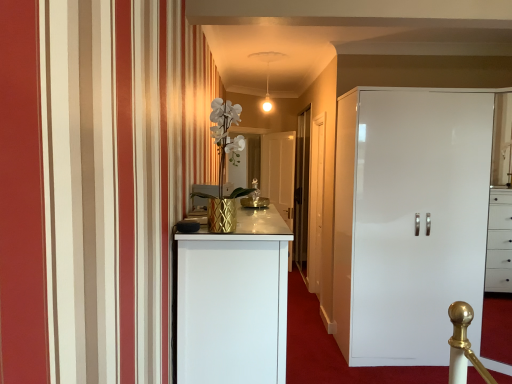
Image resolution: width=512 pixels, height=384 pixels. I want to click on white glossy door at center, the first door viewed from the back, so click(x=279, y=172).

The width and height of the screenshot is (512, 384). Describe the element at coordinates (224, 166) in the screenshot. I see `white textured vase at center` at that location.

The image size is (512, 384). Describe the element at coordinates (301, 191) in the screenshot. I see `transparent glass door at center` at that location.

This screenshot has width=512, height=384. What do you see at coordinates (316, 203) in the screenshot?
I see `white wooden door at center, the 1th door positioned from the front` at bounding box center [316, 203].

Find the location of `white glossy cupboard at right`. white glossy cupboard at right is located at coordinates (409, 220).

Describe the element at coordinates (409, 220) in the screenshot. I see `white glossy cupboard at right` at that location.

Identify the location of white glossy door at center, placed as the second door when sorted from right to left. This screenshot has width=512, height=384. (279, 172).

Is white wooden door at center, which ranks as the second door in back-to-front order, turned away from white glossy door at center, the first door viewed from the back?

No, white glossy door at center, the first door viewed from the back, is not at the back of white wooden door at center, which ranks as the second door in back-to-front order.

From the image's perspective, is white wooden door at center, positioned as the first door in right-to-left order, below white glossy door at center, the 2th door when ordered from front to back?

Yes, from the image's perspective, white wooden door at center, positioned as the first door in right-to-left order, is beneath white glossy door at center, the 2th door when ordered from front to back.

Is point (319, 218) closer or farther from the camera than point (286, 180)?

Point (319, 218).

Find the location of a particular element. door below the white glossy door at center, the 2th door when ordered from front to back (from the image's perspective) is located at coordinates (316, 203).

Is transparent glass door at center facing away from white wooden door at center, the 1th door positioned from the front?

No, transparent glass door at center is not facing away from white wooden door at center, the 1th door positioned from the front.

From the image's perspective, is transparent glass door at center beneath white wooden door at center, which ranks as the second door in back-to-front order?

Incorrect, from the image's perspective, transparent glass door at center is higher than white wooden door at center, which ranks as the second door in back-to-front order.

Is transparent glass door at center not close to white wooden door at center, which ranks as the second door in back-to-front order?

No, transparent glass door at center is not far from white wooden door at center, which ranks as the second door in back-to-front order.

Is transparent glass door at center at the right side of white wooden door at center, the 1th door positioned from the front?

No.

Can you confirm if white glossy cupboard at right is taller than white textured vase at center?

Yes, white glossy cupboard at right is taller than white textured vase at center.

Find the location of a particular element. The image size is (512, 384). cupboard below the white textured vase at center (from a real-world perspective) is located at coordinates (409, 220).

Does white glossy cupboard at right lie in front of white textured vase at center?

That is False.

Considering the relative sizes of white glossy cupboard at right and white textured vase at center in the image provided, is white glossy cupboard at right wider than white textured vase at center?

Indeed, white glossy cupboard at right has a greater width compared to white textured vase at center.

Is transparent glass door at center beside white glossy door at center, placed as the second door when sorted from right to left?

No.

Is transparent glass door at center in front of or behind white glossy door at center, the first door viewed from the back, in the image?

transparent glass door at center is positioned closer to the viewer than white glossy door at center, the first door viewed from the back.

Which is nearer, (301, 245) or (283, 148)?

Point (301, 245) appears to be closer to the viewer than point (283, 148).

Is white wooden door at center, the 1th door positioned from the front, in front of or behind transparent glass door at center in the image?

Visually, white wooden door at center, the 1th door positioned from the front, is located in front of transparent glass door at center.

Looking at the image, does white wooden door at center, which is the second door in left-to-right order, seem bigger or smaller compared to transparent glass door at center?

Considering their sizes, white wooden door at center, which is the second door in left-to-right order, takes up less space than transparent glass door at center.

Considering the relative sizes of white wooden door at center, positioned as the first door in right-to-left order, and transparent glass door at center in the image provided, is white wooden door at center, positioned as the first door in right-to-left order, thinner than transparent glass door at center?

Incorrect, the width of white wooden door at center, positioned as the first door in right-to-left order, is not less than that of transparent glass door at center.

Which is more to the right, white wooden door at center, the 1th door positioned from the front, or transparent glass door at center?

white wooden door at center, the 1th door positioned from the front, is more to the right.

Would you say transparent glass door at center is a long distance from white glossy cupboard at right?

Yes, transparent glass door at center is far from white glossy cupboard at right.

Can we say transparent glass door at center lies outside white glossy cupboard at right?

Absolutely, transparent glass door at center is external to white glossy cupboard at right.

Which is more to the right, transparent glass door at center or white glossy cupboard at right?

From the viewer's perspective, white glossy cupboard at right appears more on the right side.

Is white glossy cupboard at right taller than white wooden door at center, positioned as the first door in right-to-left order?

Yes, white glossy cupboard at right is taller than white wooden door at center, positioned as the first door in right-to-left order.

Which of these two, white glossy cupboard at right or white wooden door at center, which ranks as the second door in back-to-front order, is thinner?

white wooden door at center, which ranks as the second door in back-to-front order, is thinner.

From a real-world perspective, is white glossy cupboard at right located beneath white wooden door at center, which is the second door in left-to-right order?

Yes.

The width and height of the screenshot is (512, 384). In order to click on door on the left of the white wooden door at center, the 1th door positioned from the front in this screenshot , I will do `click(279, 172)`.

I want to click on door located on the right of transparent glass door at center, so click(x=316, y=203).

Consider the image. Based on their spatial positions, is white glossy door at center, the first door viewed from the back, or white wooden door at center, which is the second door in left-to-right order, further from white glossy cupboard at right?

white glossy door at center, the first door viewed from the back.

Which object lies nearer to the anchor point white wooden door at center, which is the second door in left-to-right order, transparent glass door at center or white glossy cupboard at right?

transparent glass door at center lies closer to white wooden door at center, which is the second door in left-to-right order, than the other object.

From the image, which object appears to be nearer to transparent glass door at center, white glossy door at center, the first door in the left-to-right sequence, or white wooden door at center, which is the second door in left-to-right order?

Based on the image, white glossy door at center, the first door in the left-to-right sequence, appears to be nearer to transparent glass door at center.

Which object lies nearer to the anchor point white glossy cupboard at right, transparent glass door at center or white glossy door at center, the first door in the left-to-right sequence?

Among the two, transparent glass door at center is located nearer to white glossy cupboard at right.

Which object lies nearer to the anchor point white glossy cupboard at right, white glossy door at center, the first door viewed from the back, or transparent glass door at center?

Among the two, transparent glass door at center is located nearer to white glossy cupboard at right.

Which object lies further to the anchor point white textured vase at center, white wooden door at center, which is the second door in left-to-right order, or transparent glass door at center?

The object further to white textured vase at center is transparent glass door at center.

Consider the image. Looking at the image, which one is located closer to white glossy door at center, the first door viewed from the back, white textured vase at center or white wooden door at center, the 1th door positioned from the front?

white wooden door at center, the 1th door positioned from the front.

Considering their positions, is white glossy door at center, the 2th door when ordered from front to back, positioned further to transparent glass door at center than white glossy cupboard at right?

Based on the image, white glossy cupboard at right appears to be further to transparent glass door at center.

Where is `door between white textured vase at center and white glossy door at center, the first door in the left-to-right sequence, from front to back`? This screenshot has height=384, width=512. door between white textured vase at center and white glossy door at center, the first door in the left-to-right sequence, from front to back is located at coordinates (316, 203).

You are a GUI agent. You are given a task and a screenshot of the screen. Output one action in this format:
    pyautogui.click(x=<x>, y=<y>)
    Task: Click on the cupboard between white textured vase at center and white glossy door at center, the 2th door when ordered from front to back, from front to back
    The height and width of the screenshot is (384, 512).
    Given the screenshot: What is the action you would take?
    pyautogui.click(x=409, y=220)

You are a GUI agent. You are given a task and a screenshot of the screen. Output one action in this format:
    pyautogui.click(x=<x>, y=<y>)
    Task: Click on the glass door between white glossy cupboard at right and white glossy door at center, the 2th door when ordered from front to back, along the z-axis
    
    Given the screenshot: What is the action you would take?
    pyautogui.click(x=301, y=191)

Where is `door positioned between white glossy cupboard at right and transparent glass door at center from near to far`? Image resolution: width=512 pixels, height=384 pixels. door positioned between white glossy cupboard at right and transparent glass door at center from near to far is located at coordinates pos(316,203).